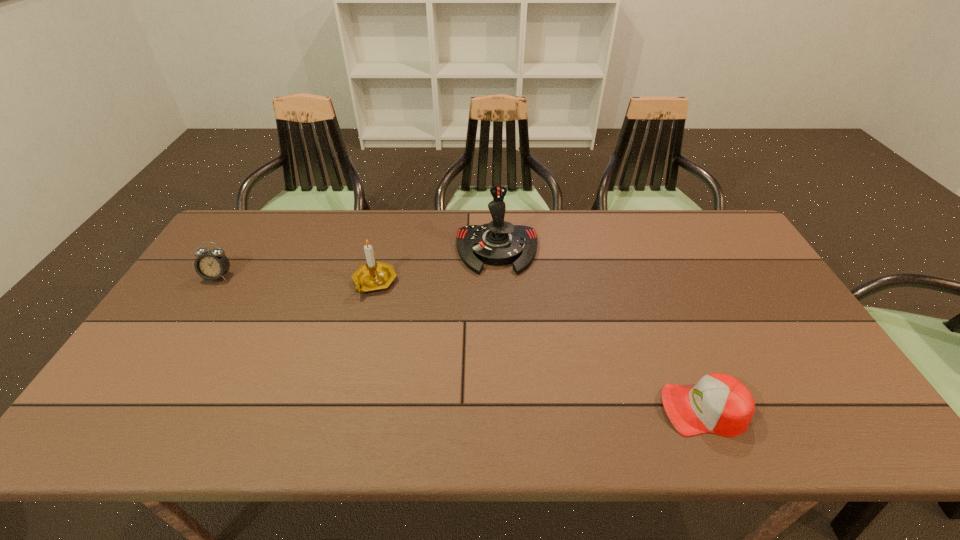
Where is `vacant space at the far right corner of the desktop`? This screenshot has height=540, width=960. vacant space at the far right corner of the desktop is located at coordinates (717, 210).

Where is `vacant space in between the baseball cap and the candle holder`? vacant space in between the baseball cap and the candle holder is located at coordinates (539, 346).

Where is `vacant region between the joystick and the leftmost object`? The height and width of the screenshot is (540, 960). vacant region between the joystick and the leftmost object is located at coordinates (358, 264).

You are a GUI agent. You are given a task and a screenshot of the screen. Output one action in this format:
    pyautogui.click(x=<x>, y=<y>)
    Task: Click on the free space between the third object from right to left and the second object from right to left
    
    Given the screenshot: What is the action you would take?
    pyautogui.click(x=436, y=266)

Where is `vacant space in between the nearest object and the candle holder`? The image size is (960, 540). vacant space in between the nearest object and the candle holder is located at coordinates (539, 346).

In order to click on vacant area that lies between the nearest object and the joystick in this screenshot , I will do `click(600, 330)`.

Find the location of `vacant area that lies between the alarm clock and the tallest object`. vacant area that lies between the alarm clock and the tallest object is located at coordinates (358, 264).

You are a GUI agent. You are given a task and a screenshot of the screen. Output one action in this format:
    pyautogui.click(x=<x>, y=<y>)
    Task: Click on the unoccupied position between the joystick and the baseball cap
    Image resolution: width=960 pixels, height=540 pixels.
    Given the screenshot: What is the action you would take?
    pyautogui.click(x=600, y=330)

This screenshot has width=960, height=540. Identify the location of free space between the joystick and the baseball cap. (600, 330).

The height and width of the screenshot is (540, 960). I want to click on vacant area that lies between the nearest object and the leftmost object, so click(461, 343).